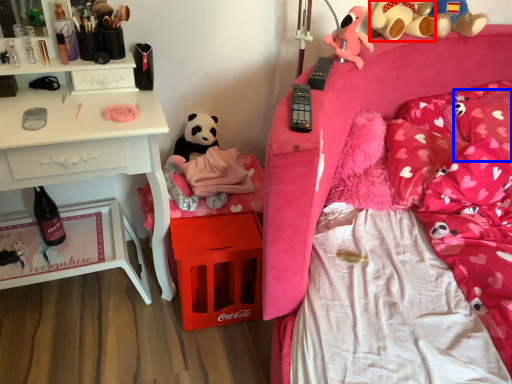
Question: Which point is closer to the camera, teddy bear (highlighted by a red box) or pillow (highlighted by a blue box)?

Choices:
 (A) teddy bear
 (B) pillow

Answer: (B)